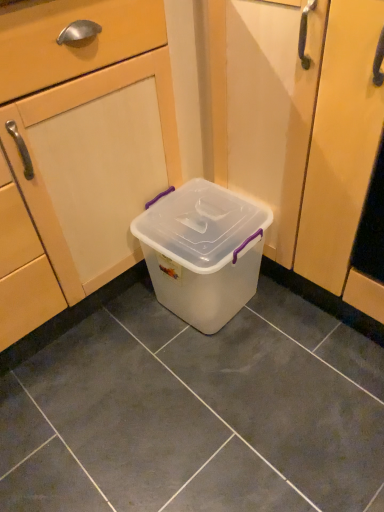
Find the location of `free space above transparent plastic storage box at center (from a real-world perspective)`. free space above transparent plastic storage box at center (from a real-world perspective) is located at coordinates (201, 226).